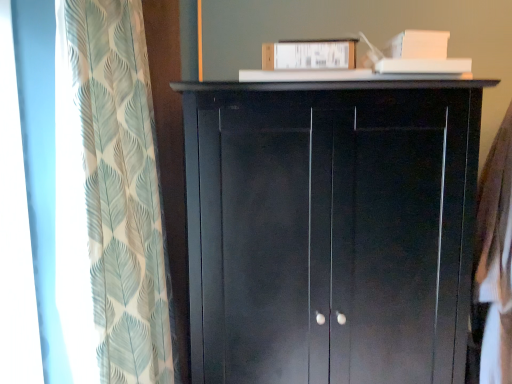
Where is `translucent leaf-patterned curtain at left`? translucent leaf-patterned curtain at left is located at coordinates (109, 198).

Locate an element on the screen. This screenshot has width=512, height=384. matte black cupboard at center is located at coordinates (331, 229).

Relative to white cotton shirt at right, is translucent leaf-patterned curtain at left in front or behind?

translucent leaf-patterned curtain at left is in front of white cotton shirt at right.

From the picture: How different are the orientations of translucent leaf-patterned curtain at left and white cotton shirt at right in degrees?

The angle between the facing direction of translucent leaf-patterned curtain at left and the facing direction of white cotton shirt at right is 140 degrees.

Is translucent leaf-patterned curtain at left positioned beyond the bounds of white cotton shirt at right?

Yes, translucent leaf-patterned curtain at left is outside of white cotton shirt at right.

What's the angular difference between matte black cupboard at center and translucent leaf-patterned curtain at left's facing directions?

matte black cupboard at center and translucent leaf-patterned curtain at left are facing 92.7 degrees away from each other.

Consider the image. Is matte black cupboard at center aimed at translucent leaf-patterned curtain at left?

No, matte black cupboard at center does not turn towards translucent leaf-patterned curtain at left.

Considering the sizes of objects matte black cupboard at center and translucent leaf-patterned curtain at left in the image provided, who is wider, matte black cupboard at center or translucent leaf-patterned curtain at left?

Wider between the two is matte black cupboard at center.

Is white cotton shirt at right turned away from translucent leaf-patterned curtain at left?

white cotton shirt at right is not turned away from translucent leaf-patterned curtain at left.

Is white cotton shirt at right spatially inside translucent leaf-patterned curtain at left, or outside of it?

white cotton shirt at right is located beyond the bounds of translucent leaf-patterned curtain at left.

Does point (503, 136) come farther from viewer compared to point (86, 39)?

Yes.

How many degrees apart are the facing directions of white cotton shirt at right and translucent leaf-patterned curtain at left?

They differ by 140 degrees in their facing directions.

Is matte black cupboard at center not near white cotton shirt at right?

matte black cupboard at center is actually quite close to white cotton shirt at right.

Between matte black cupboard at center and white cotton shirt at right, which one has smaller width?

white cotton shirt at right is thinner.

Which object is closer to the camera, matte black cupboard at center or white cotton shirt at right?

matte black cupboard at center is more forward.

Is matte black cupboard at center at the back of white cotton shirt at right?

No.

From the picture: Is white cotton shirt at right shorter than matte black cupboard at center?

Indeed, white cotton shirt at right has a lesser height compared to matte black cupboard at center.

Would you say white cotton shirt at right is outside matte black cupboard at center?

Actually, white cotton shirt at right is within matte black cupboard at center.

Is translucent leaf-patterned curtain at left with matte black cupboard at center?

No, translucent leaf-patterned curtain at left is not touching matte black cupboard at center.

In the scene shown: From a real-world perspective, is translucent leaf-patterned curtain at left located higher than matte black cupboard at center?

Yes, from a real-world perspective, translucent leaf-patterned curtain at left is above matte black cupboard at center.

Locate an element on the screen. cupboard directly beneath the translucent leaf-patterned curtain at left (from a real-world perspective) is located at coordinates (331, 229).

Considering the relative sizes of translucent leaf-patterned curtain at left and matte black cupboard at center in the image provided, is translucent leaf-patterned curtain at left bigger than matte black cupboard at center?

Incorrect, translucent leaf-patterned curtain at left is not larger than matte black cupboard at center.

Where is `curtain that appears above the white cotton shirt at right (from a real-world perspective)`? This screenshot has width=512, height=384. curtain that appears above the white cotton shirt at right (from a real-world perspective) is located at coordinates (109, 198).

Where is `curtain located above the matte black cupboard at center (from the image's perspective)`? curtain located above the matte black cupboard at center (from the image's perspective) is located at coordinates (109, 198).

When comparing their distances from translucent leaf-patterned curtain at left, does matte black cupboard at center or white cotton shirt at right seem further?

The object further to translucent leaf-patterned curtain at left is white cotton shirt at right.

Which object lies nearer to the anchor point white cotton shirt at right, matte black cupboard at center or translucent leaf-patterned curtain at left?

matte black cupboard at center lies closer to white cotton shirt at right than the other object.

From the image, which object appears to be nearer to translucent leaf-patterned curtain at left, white cotton shirt at right or matte black cupboard at center?

matte black cupboard at center is positioned closer to the anchor translucent leaf-patterned curtain at left.

When comparing their distances from white cotton shirt at right, does translucent leaf-patterned curtain at left or matte black cupboard at center seem closer?

Among the two, matte black cupboard at center is located nearer to white cotton shirt at right.

Estimate the real-world distances between objects in this image. Which object is closer to matte black cupboard at center, translucent leaf-patterned curtain at left or white cotton shirt at right?

translucent leaf-patterned curtain at left is positioned closer to the anchor matte black cupboard at center.

Based on their spatial positions, is white cotton shirt at right or translucent leaf-patterned curtain at left further from matte black cupboard at center?

Based on the image, white cotton shirt at right appears to be further to matte black cupboard at center.

I want to click on cupboard situated between translucent leaf-patterned curtain at left and white cotton shirt at right from left to right, so click(331, 229).